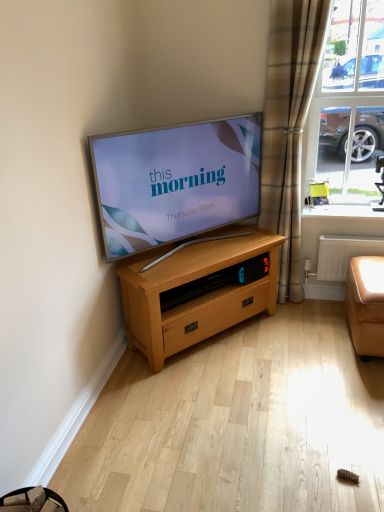
The height and width of the screenshot is (512, 384). What do you see at coordinates (366, 304) in the screenshot?
I see `leather-like orange couch at lower right` at bounding box center [366, 304].

Image resolution: width=384 pixels, height=512 pixels. Find the location of `plaid fabric curtain at right`. plaid fabric curtain at right is located at coordinates (288, 126).

Measure the distance between tan leather armchair at right and camera.

tan leather armchair at right is 9.39 feet from camera.

Find the location of a particular element. This screenshot has width=384, height=512. matte silver tv at center is located at coordinates tap(175, 181).

Find the location of `leather-like orange couch at lower right`. leather-like orange couch at lower right is located at coordinates (366, 304).

From a real-world perspective, who is located lower, matte silver tv at center or white plastic radiator at lower right?

white plastic radiator at lower right, from a real-world perspective.

Based on the photo, can you confirm if matte silver tv at center is thinner than white plastic radiator at lower right?

In fact, matte silver tv at center might be wider than white plastic radiator at lower right.

I want to click on television lying above the white plastic radiator at lower right (from the image's perspective), so click(x=175, y=181).

Are matte silver tv at center and white plastic radiator at lower right beside each other?

They are not placed beside each other.

Choose the correct answer: Is leather-like orange couch at lower right inside clear glass window at upper right or outside it?

leather-like orange couch at lower right is outside clear glass window at upper right.

Is leather-like orange couch at lower right touching clear glass window at upper right?

No, leather-like orange couch at lower right is not touching clear glass window at upper right.

Choose the correct answer: Is plaid fabric curtain at right inside matte silver tv at center or outside it?

plaid fabric curtain at right is not enclosed by matte silver tv at center.

In the scene shown: Can you confirm if plaid fabric curtain at right is smaller than matte silver tv at center?

Yes, plaid fabric curtain at right is smaller than matte silver tv at center.

Can you tell me how much plaid fabric curtain at right and matte silver tv at center differ in facing direction?

The angle between the facing direction of plaid fabric curtain at right and the facing direction of matte silver tv at center is 48.5 degrees.

From a real-world perspective, is white plastic radiator at lower right positioned over leather-like orange couch at lower right based on gravity?

Indeed, from a real-world perspective, white plastic radiator at lower right stands above leather-like orange couch at lower right.

This screenshot has width=384, height=512. In order to click on radiator above the leather-like orange couch at lower right (from the image's perspective) in this screenshot , I will do `click(344, 254)`.

Considering the relative sizes of white plastic radiator at lower right and leather-like orange couch at lower right in the image provided, is white plastic radiator at lower right wider than leather-like orange couch at lower right?

No.

Is clear glass window at upper right outside of tan leather armchair at right?

That's correct, clear glass window at upper right is outside of tan leather armchair at right.

Can you tell me how much clear glass window at upper right and tan leather armchair at right differ in facing direction?

The angle between the facing direction of clear glass window at upper right and the facing direction of tan leather armchair at right is 25.6 degrees.

Is clear glass window at upper right looking in the opposite direction of tan leather armchair at right?

Absolutely, clear glass window at upper right is directed away from tan leather armchair at right.

Measure the distance from clear glass window at upper right to tan leather armchair at right.

A distance of 44.88 centimeters exists between clear glass window at upper right and tan leather armchair at right.

Is tan leather armchair at right outside of matte silver tv at center?

Indeed, tan leather armchair at right is completely outside matte silver tv at center.

From a real-world perspective, is tan leather armchair at right physically located above or below matte silver tv at center?

tan leather armchair at right is situated lower than matte silver tv at center in the real world.

Consider the image. Is tan leather armchair at right wider or thinner than matte silver tv at center?

In the image, tan leather armchair at right appears to be more narrow than matte silver tv at center.

Is point (321, 185) closer to camera compared to point (128, 197)?

No, it is behind (128, 197).

From the image's perspective, does tan leather armchair at right appear higher than plaid fabric curtain at right?

Incorrect, from the image's perspective, tan leather armchair at right is lower than plaid fabric curtain at right.

Is tan leather armchair at right bigger or smaller than plaid fabric curtain at right?

tan leather armchair at right is smaller than plaid fabric curtain at right.

Which is more distant, (317,184) or (278,219)?

Point (317,184)

Can you see tan leather armchair at right touching plaid fabric curtain at right?

No, tan leather armchair at right is not with plaid fabric curtain at right.

Find the location of a particular element. This screenshot has width=384, height=512. radiator behind the matte silver tv at center is located at coordinates (344, 254).

Locate an element on the screen. studio couch on the right of clear glass window at upper right is located at coordinates (366, 304).

When comparing their distances from white plastic radiator at lower right, does light oak wooden chest of drawers at center or clear glass window at upper right seem closer?

clear glass window at upper right.

Estimate the real-world distances between objects in this image. Which object is further from light oak wooden chest of drawers at center, leather-like orange couch at lower right or white plastic radiator at lower right?

leather-like orange couch at lower right is positioned further to the anchor light oak wooden chest of drawers at center.

Looking at the image, which one is located further to clear glass window at upper right, plaid fabric curtain at right or matte silver tv at center?

matte silver tv at center.

Which object lies further to the anchor point light oak wooden chest of drawers at center, matte silver tv at center or white plastic radiator at lower right?

The object further to light oak wooden chest of drawers at center is white plastic radiator at lower right.

Based on their spatial positions, is white glossy window sill at upper right or matte silver tv at center closer to light oak wooden chest of drawers at center?

matte silver tv at center is closer to light oak wooden chest of drawers at center.

When comparing their distances from leather-like orange couch at lower right, does white glossy window sill at upper right or tan leather armchair at right seem closer?

The object closer to leather-like orange couch at lower right is white glossy window sill at upper right.

From the image, which object appears to be farther from clear glass window at upper right, white plastic radiator at lower right or tan leather armchair at right?

white plastic radiator at lower right lies further to clear glass window at upper right than the other object.

Based on their spatial positions, is white plastic radiator at lower right or white glossy window sill at upper right closer to plaid fabric curtain at right?

The object closer to plaid fabric curtain at right is white glossy window sill at upper right.

The image size is (384, 512). Identify the location of the chest of drawers situated between matte silver tv at center and clear glass window at upper right from left to right. (195, 295).

At what (x,y) coordinates should I click in order to perform the action: click on window between plaid fabric curtain at right and tan leather armchair at right from front to back. Please return your answer as a coordinate pair (x, y). The height and width of the screenshot is (512, 384). Looking at the image, I should click on (349, 105).

You are a GUI agent. You are given a task and a screenshot of the screen. Output one action in this format:
    pyautogui.click(x=<x>, y=<y>)
    Task: Click on the radiator situated between light oak wooden chest of drawers at center and leather-like orange couch at lower right from left to right
    The height and width of the screenshot is (512, 384).
    Given the screenshot: What is the action you would take?
    pyautogui.click(x=344, y=254)

The width and height of the screenshot is (384, 512). What are the coordinates of `curtain between light oak wooden chest of drawers at center and white plastic radiator at lower right in the horizontal direction` in the screenshot? It's located at (288, 126).